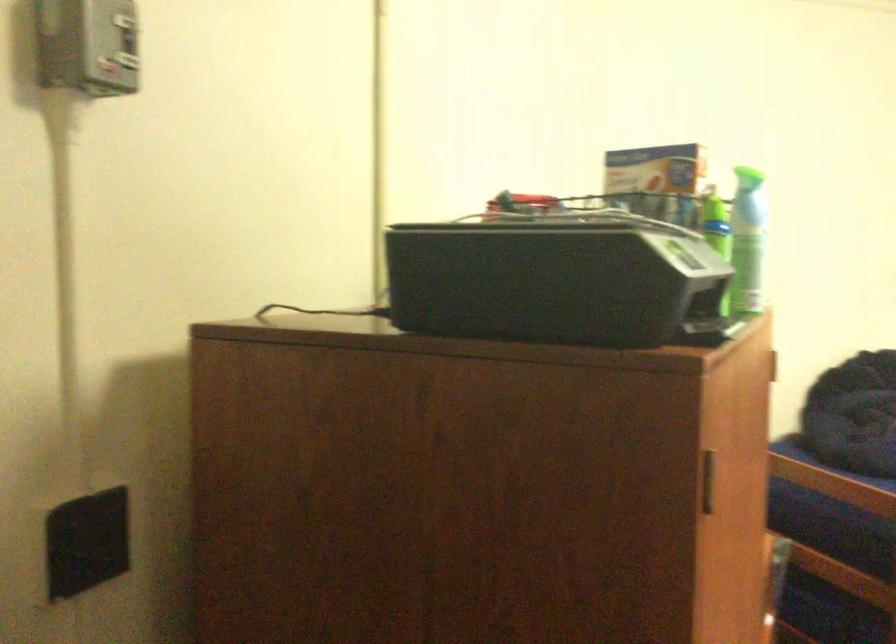
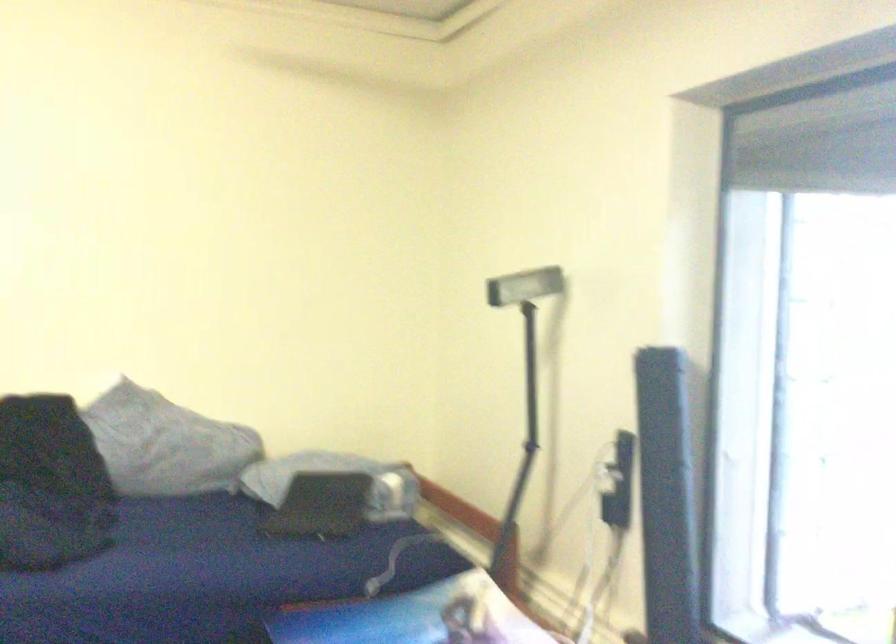
Question: What movement of the cameraman would produce the second image?

Choices:
 (A) Left
 (B) Right
 (C) Forward
 (D) Backward

Answer: (B)